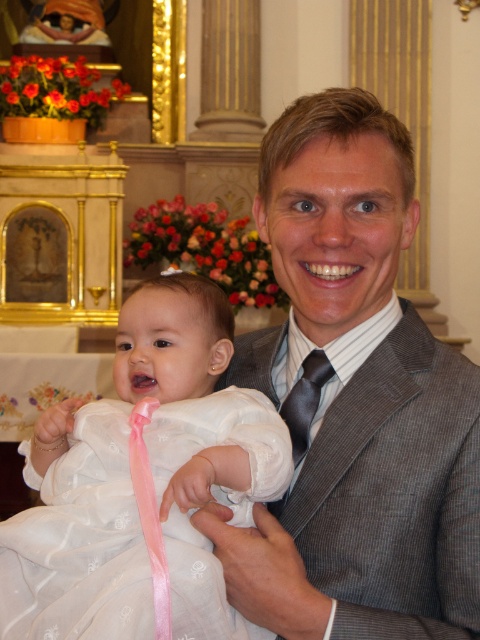
Question: Which object is farther from the camera taking this photo?

Choices:
 (A) white satin dress at center
 (B) gray textured suit at center

Answer: (B)

Question: Which of the following is the closest to the observer?

Choices:
 (A) dark brown silk tie at center
 (B) white satin dress at center
 (C) gray textured suit at center

Answer: (B)

Question: Among these points, which one is nearest to the camera?

Choices:
 (A) (462, 401)
 (B) (310, 387)

Answer: (A)

Question: Is white satin dress at center to the right of dark brown silk tie at center from the viewer's perspective?

Choices:
 (A) no
 (B) yes

Answer: (A)

Question: Does gray textured suit at center have a lesser width compared to dark brown silk tie at center?

Choices:
 (A) yes
 (B) no

Answer: (B)

Question: Is gray textured suit at center positioned behind white satin dress at center?

Choices:
 (A) no
 (B) yes

Answer: (B)